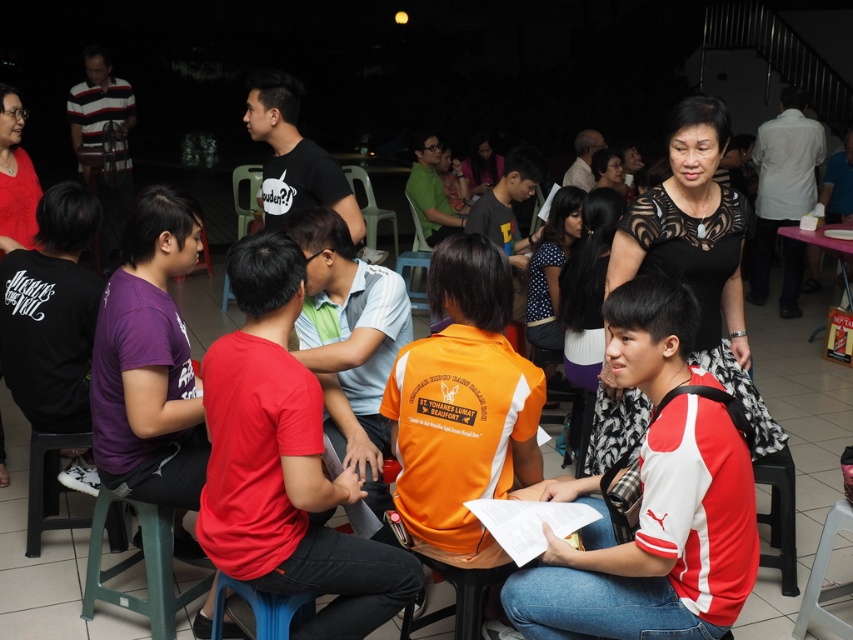
You are organizing a small event and need to arrange seating. You have a red matte shirt at center and a blue plastic chair at lower center. Which object is located to the right of the other?

The red matte shirt at center is positioned on the right side of blue plastic chair at lower center.